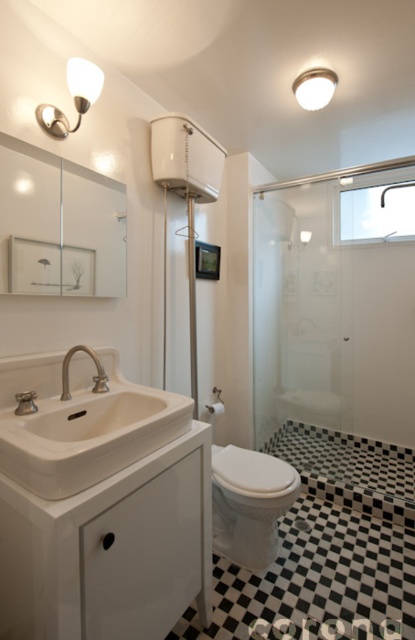
You are a home inspector assessing the bathroom layout. You need to determine if the white glossy toilet at center will fit through a doorway that is 2 meters tall. The white frosted glass dome at upper center is 1.5 meters tall. Can the toilet pass through the doorway?

The white glossy toilet at center is taller than the white frosted glass dome at upper center, which is 1.5 meters tall. Since the doorway is 2 meters tall, the toilet can pass through as its height is less than 2 meters.

You are a home inspector examining the bathroom layout. You need to determine the spatial arrangement between the transparent glass shower door at center and the white ceramic sink at lower left. Which object is located to the right of the other?

The transparent glass shower door at center is positioned on the right side of white ceramic sink at lower left.

You are a contractor measuring the height of fixtures in a bathroom. You see the matte white sconce at upper left and the white frosted glass dome at upper center. Which one has a greater height?

The matte white sconce at upper left is much taller than the white frosted glass dome at upper center, so the matte white sconce at upper left has a greater height.